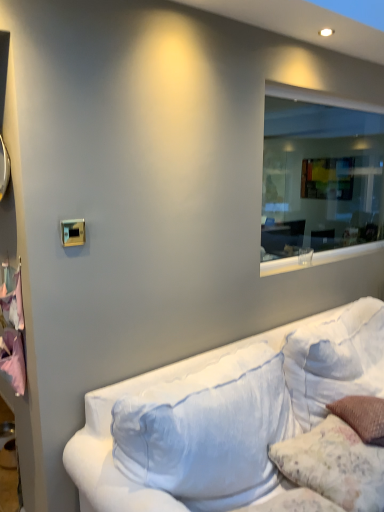
Question: Does pink fabric at left appear on the right side of fluffy white pillow at lower right?

Choices:
 (A) yes
 (B) no

Answer: (B)

Question: Does pink fabric at left have a greater width compared to fluffy white pillow at lower right?

Choices:
 (A) yes
 (B) no

Answer: (B)

Question: Is pink fabric at left next to fluffy white pillow at lower right?

Choices:
 (A) no
 (B) yes

Answer: (A)

Question: Is pink fabric at left not close to fluffy white pillow at lower right?

Choices:
 (A) no
 (B) yes

Answer: (B)

Question: Does pink fabric at left come behind fluffy white pillow at lower right?

Choices:
 (A) yes
 (B) no

Answer: (A)

Question: Is pink fabric at left in front of or behind transparent glass window at upper right in the image?

Choices:
 (A) front
 (B) behind

Answer: (A)

Question: Is pink fabric at left taller or shorter than transparent glass window at upper right?

Choices:
 (A) tall
 (B) short

Answer: (B)

Question: Considering the positions of pink fabric at left and transparent glass window at upper right in the image, is pink fabric at left bigger or smaller than transparent glass window at upper right?

Choices:
 (A) small
 (B) big

Answer: (A)

Question: From the image's perspective, is pink fabric at left above or below transparent glass window at upper right?

Choices:
 (A) below
 (B) above

Answer: (A)

Question: Considering the positions of white fabric couch at lower right and fluffy white pillow at lower right in the image, is white fabric couch at lower right taller or shorter than fluffy white pillow at lower right?

Choices:
 (A) tall
 (B) short

Answer: (A)

Question: Considering the positions of white fabric couch at lower right and fluffy white pillow at lower right in the image, is white fabric couch at lower right bigger or smaller than fluffy white pillow at lower right?

Choices:
 (A) small
 (B) big

Answer: (B)

Question: Considering the positions of point (155, 471) and point (301, 483), is point (155, 471) closer or farther from the camera than point (301, 483)?

Choices:
 (A) farther
 (B) closer

Answer: (B)

Question: From a real-world perspective, relative to fluffy white pillow at lower right, is white fabric couch at lower right vertically above or below?

Choices:
 (A) below
 (B) above

Answer: (A)

Question: Would you say transparent glass window at upper right is inside or outside fluffy white pillow at lower right?

Choices:
 (A) inside
 (B) outside

Answer: (B)

Question: Considering their positions, is transparent glass window at upper right located in front of or behind fluffy white pillow at lower right?

Choices:
 (A) behind
 (B) front

Answer: (A)